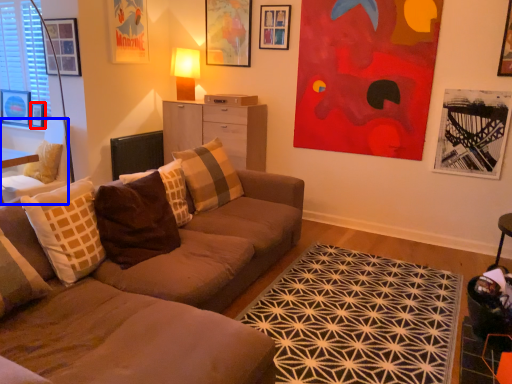
Question: Which point is further to the camera, picture frame (highlighted by a red box) or chair (highlighted by a blue box)?

Choices:
 (A) picture frame
 (B) chair

Answer: (A)